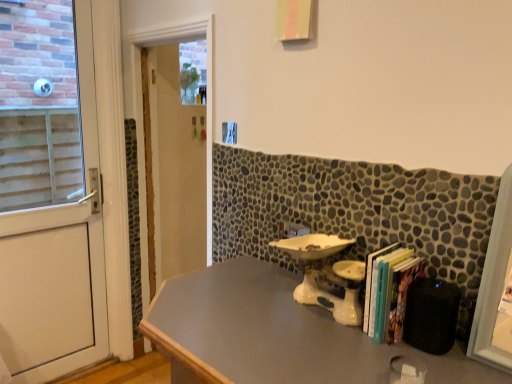
At what (x,y) coordinates should I click in order to perform the action: click on vacant position to the left of hardcover books at right. Please return your answer as a coordinate pair (x, y). Looking at the image, I should click on (324, 341).